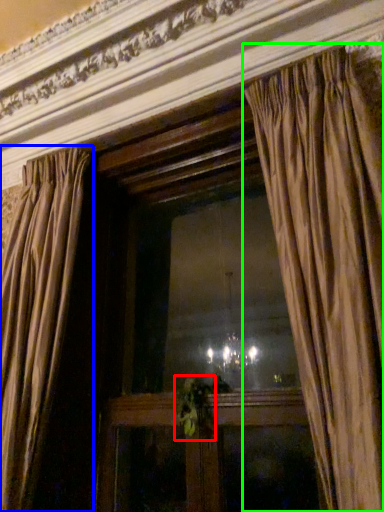
Question: Considering the real-world distances, which object is closest to plant (highlighted by a red box)? curtain (highlighted by a blue box) or curtain (highlighted by a green box).

Choices:
 (A) curtain
 (B) curtain

Answer: (A)